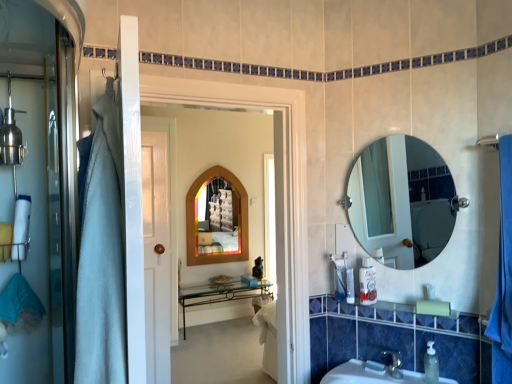
This screenshot has height=384, width=512. What do you see at coordinates (21, 228) in the screenshot? I see `white fabric bath towel at left` at bounding box center [21, 228].

What is the approximate height of white fabric towel at left?

75.38 centimeters.

Describe the element at coordinates (102, 256) in the screenshot. This screenshot has width=512, height=384. I see `white fabric towel at left` at that location.

This screenshot has width=512, height=384. Describe the element at coordinates (218, 219) in the screenshot. I see `wooden-framed mirror at center, which appears as the 2th mirror when viewed from the right` at that location.

This screenshot has width=512, height=384. Find the location of `translucent plastic soap at lower right`. translucent plastic soap at lower right is located at coordinates (375, 366).

The width and height of the screenshot is (512, 384). I want to click on white fabric bath towel at left, so click(21, 228).

Is translucent plastic soap at lower right taller than wooden-framed mirror at center, arranged as the 1th mirror when viewed from the back?

Incorrect, the height of translucent plastic soap at lower right is not larger of that of wooden-framed mirror at center, arranged as the 1th mirror when viewed from the back.

Which of these two, translucent plastic soap at lower right or wooden-framed mirror at center, the second mirror viewed from the front, is thinner?

Thinner between the two is wooden-framed mirror at center, the second mirror viewed from the front.

Identify the location of soap below the wooden-framed mirror at center, which appears as the 2th mirror when viewed from the right (from a real-world perspective). (375, 366).

Is translucent plastic soap at lower right aimed at wooden-framed mirror at center, the 1th mirror from the left?

No, translucent plastic soap at lower right is not aimed at wooden-framed mirror at center, the 1th mirror from the left.

Can you tell me how much translucent plastic soap dispenser at lower right, acting as the first toiletry starting from the left, and wooden mirror at center differ in facing direction?

The angular difference between translucent plastic soap dispenser at lower right, acting as the first toiletry starting from the left, and wooden mirror at center is 7.3 degrees.

Which object is further away from the camera taking this photo, translucent plastic soap dispenser at lower right, placed as the second toiletry when sorted from bottom to top, or wooden mirror at center?

translucent plastic soap dispenser at lower right, placed as the second toiletry when sorted from bottom to top, is more distant.

Is translucent plastic soap dispenser at lower right, the 1th toiletry from the back, to the left or to the right of wooden mirror at center in the image?

translucent plastic soap dispenser at lower right, the 1th toiletry from the back, is to the right of wooden mirror at center.

Considering the sizes of objects translucent plastic soap dispenser at lower right, the 2th toiletry viewed from the top, and wooden mirror at center in the image provided, who is shorter, translucent plastic soap dispenser at lower right, the 2th toiletry viewed from the top, or wooden mirror at center?

With less height is translucent plastic soap dispenser at lower right, the 2th toiletry viewed from the top.

Who is shorter, white fabric towel at left or white plastic container at right, the 2th toiletry when ordered from front to back?

white plastic container at right, the 2th toiletry when ordered from front to back.

Is white fabric towel at left far from white plastic container at right, arranged as the 1th toiletry when viewed from the top?

Indeed, white fabric towel at left is not near white plastic container at right, arranged as the 1th toiletry when viewed from the top.

Between white fabric towel at left and white plastic container at right, marked as the second toiletry in a right-to-left arrangement, which one has larger width?

white fabric towel at left is wider.

Considering the relative sizes of clear glass mirror at upper right, the 2th mirror viewed from the left, and translucent plastic soap at lower right in the image provided, is clear glass mirror at upper right, the 2th mirror viewed from the left, shorter than translucent plastic soap at lower right?

In fact, clear glass mirror at upper right, the 2th mirror viewed from the left, may be taller than translucent plastic soap at lower right.

Between clear glass mirror at upper right, which is the 1th mirror in front-to-back order, and translucent plastic soap at lower right, which one has larger width?

clear glass mirror at upper right, which is the 1th mirror in front-to-back order, is wider.

Identify the location of soap located underneath the clear glass mirror at upper right, which appears as the 1th mirror when viewed from the right (from a real-world perspective). (375, 366).

Is clear glass mirror at upper right, which appears as the 1th mirror when viewed from the right, touching translucent plastic soap at lower right?

No, clear glass mirror at upper right, which appears as the 1th mirror when viewed from the right, is not beside translucent plastic soap at lower right.

Looking at this image, from the image's perspective, which is below, white fabric bath towel at left or clear glass mirror at upper right, which is the 2th mirror from back to front?

white fabric bath towel at left.

Considering the relative sizes of white fabric bath towel at left and clear glass mirror at upper right, the 2th mirror viewed from the left, in the image provided, is white fabric bath towel at left taller than clear glass mirror at upper right, the 2th mirror viewed from the left,?

No, white fabric bath towel at left is not taller than clear glass mirror at upper right, the 2th mirror viewed from the left.

Considering the relative positions of white fabric bath towel at left and clear glass mirror at upper right, which appears as the 1th mirror when viewed from the right, in the image provided, is white fabric bath towel at left in front of clear glass mirror at upper right, which appears as the 1th mirror when viewed from the right,?

That is True.

From a real-world perspective, is white fabric bath towel at left positioned over clear glass mirror at upper right, which is the 1th mirror in front-to-back order, based on gravity?

Incorrect, from a real-world perspective, white fabric bath towel at left is lower than clear glass mirror at upper right, which is the 1th mirror in front-to-back order.

Between clear plastic soap dispenser at lower right, marked as the 1th toiletry in a bottom-to-top arrangement, and wooden-framed mirror at center, arranged as the 1th mirror when viewed from the back, which one is positioned in front?

clear plastic soap dispenser at lower right, marked as the 1th toiletry in a bottom-to-top arrangement, is more forward.

From a real-world perspective, is clear plastic soap dispenser at lower right, marked as the 1th toiletry in a bottom-to-top arrangement, physically above wooden-framed mirror at center, arranged as the 1th mirror when viewed from the back?

No, from a real-world perspective, clear plastic soap dispenser at lower right, marked as the 1th toiletry in a bottom-to-top arrangement, is not over wooden-framed mirror at center, arranged as the 1th mirror when viewed from the back

Is clear plastic soap dispenser at lower right, marked as the 1th toiletry in a bottom-to-top arrangement, in contact with wooden-framed mirror at center, the 1th mirror from the left?

clear plastic soap dispenser at lower right, marked as the 1th toiletry in a bottom-to-top arrangement, is not next to wooden-framed mirror at center, the 1th mirror from the left, and they're not touching.

Consider the image. Considering the positions of objects clear plastic soap dispenser at lower right, marked as the 1th toiletry in a bottom-to-top arrangement, and wooden-framed mirror at center, the second mirror viewed from the front, in the image provided, who is more to the left, clear plastic soap dispenser at lower right, marked as the 1th toiletry in a bottom-to-top arrangement, or wooden-framed mirror at center, the second mirror viewed from the front,?

From the viewer's perspective, wooden-framed mirror at center, the second mirror viewed from the front, appears more on the left side.

Between wooden mirror at center and clear plastic soap dispenser at lower right, which is the first toiletry from front to back, which one has larger size?

wooden mirror at center is bigger.

Where is `screen door above the clear plastic soap dispenser at lower right, which ranks as the third toiletry in top-to-bottom order (from the image's perspective)`? The height and width of the screenshot is (384, 512). screen door above the clear plastic soap dispenser at lower right, which ranks as the third toiletry in top-to-bottom order (from the image's perspective) is located at coordinates (284, 146).

Considering the relative sizes of wooden mirror at center and clear plastic soap dispenser at lower right, which appears as the third toiletry when viewed from the left, in the image provided, is wooden mirror at center taller than clear plastic soap dispenser at lower right, which appears as the third toiletry when viewed from the left,?

Yes, wooden mirror at center is taller than clear plastic soap dispenser at lower right, which appears as the third toiletry when viewed from the left.

Is wooden mirror at center not inside clear plastic soap dispenser at lower right, which is the 3th toiletry from back to front?

Absolutely, wooden mirror at center is external to clear plastic soap dispenser at lower right, which is the 3th toiletry from back to front.

Locate an element on the screen. The height and width of the screenshot is (384, 512). mirror that is on the left side of translucent plastic soap at lower right is located at coordinates (218, 219).

At what (x,y) coordinates should I click in order to perform the action: click on toiletry that is the 3rd one when counting backward from the wooden mirror at center. Please return your answer as a coordinate pair (x, y). The image size is (512, 384). Looking at the image, I should click on (339, 280).

When comparing their distances from translucent plastic soap dispenser at lower right, the 1th toiletry from the back, does clear plastic soap dispenser at lower right, which ranks as the third toiletry in top-to-bottom order, or white fabric towel at left seem further?

white fabric towel at left lies further to translucent plastic soap dispenser at lower right, the 1th toiletry from the back, than the other object.

Which object lies nearer to the anchor point wooden-framed mirror at center, the 1th mirror from the left, white fabric towel at left or wooden mirror at center?

wooden mirror at center lies closer to wooden-framed mirror at center, the 1th mirror from the left, than the other object.

Estimate the real-world distances between objects in this image. Which object is closer to white fabric towel at left, translucent plastic soap dispenser at lower right, arranged as the third toiletry when viewed from the right, or wooden mirror at center?

wooden mirror at center is positioned closer to the anchor white fabric towel at left.

Which object lies nearer to the anchor point clear glass mirror at upper right, which appears as the 1th mirror when viewed from the right, white fabric bath towel at left or translucent plastic soap at lower right?

translucent plastic soap at lower right is positioned closer to the anchor clear glass mirror at upper right, which appears as the 1th mirror when viewed from the right.

Based on their spatial positions, is translucent plastic soap dispenser at lower right, the third toiletry positioned from the front, or white plastic container at right, which appears as the 2th toiletry when viewed from the left, further from white fabric bath towel at left?

The object further to white fabric bath towel at left is white plastic container at right, which appears as the 2th toiletry when viewed from the left.

Estimate the real-world distances between objects in this image. Which object is closer to clear plastic soap dispenser at lower right, the 1th toiletry from the right, clear glass mirror at upper right, which is the 1th mirror in front-to-back order, or wooden-framed mirror at center, the second mirror viewed from the front?

The object closer to clear plastic soap dispenser at lower right, the 1th toiletry from the right, is clear glass mirror at upper right, which is the 1th mirror in front-to-back order.

Consider the image. Based on their spatial positions, is translucent plastic soap dispenser at lower right, acting as the first toiletry starting from the left, or white fabric bath towel at left closer to translucent plastic soap at lower right?

The object closer to translucent plastic soap at lower right is translucent plastic soap dispenser at lower right, acting as the first toiletry starting from the left.

Looking at the image, which one is located further to wooden mirror at center, translucent plastic soap at lower right or clear glass mirror at upper right, the 2th mirror viewed from the left?

Based on the image, clear glass mirror at upper right, the 2th mirror viewed from the left, appears to be further to wooden mirror at center.

You are a GUI agent. You are given a task and a screenshot of the screen. Output one action in this format:
    pyautogui.click(x=<x>, y=<y>)
    Task: Click on the toiletry between clear glass mirror at upper right, which is the 1th mirror in front-to-back order, and translucent plastic soap dispenser at lower right, placed as the second toiletry when sorted from bottom to top, in the up-down direction
    
    Given the screenshot: What is the action you would take?
    pyautogui.click(x=367, y=282)

Identify the location of screen door between white fabric bath towel at left and translucent plastic soap at lower right. The height and width of the screenshot is (384, 512). (284, 146).

Where is `screen door located between white fabric bath towel at left and wooden-framed mirror at center, the second mirror viewed from the front, in the depth direction`? This screenshot has width=512, height=384. screen door located between white fabric bath towel at left and wooden-framed mirror at center, the second mirror viewed from the front, in the depth direction is located at coordinates (284, 146).

Identify the location of screen door located between white fabric bath towel at left and clear plastic soap dispenser at lower right, which is the first toiletry from front to back, in the left-right direction. The height and width of the screenshot is (384, 512). [x=284, y=146].